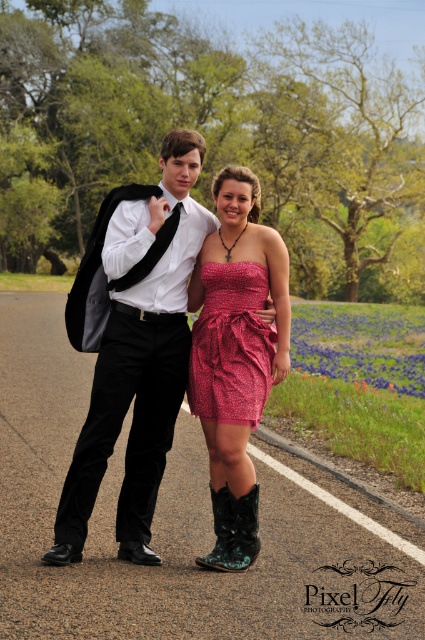
Is point (232, 515) positioned behind point (149, 262)?

That is False.

Does turquoise leather boot at lower center appear under black satin tie at center?

Indeed, turquoise leather boot at lower center is positioned under black satin tie at center.

Is point (215, 561) behind point (175, 211)?

No.

Where is `turquoise leather boot at lower center`? The width and height of the screenshot is (425, 640). turquoise leather boot at lower center is located at coordinates (235, 529).

Who is lower down, green suede boot at lower center or black satin tie at center?

green suede boot at lower center is below.

Which of these two, green suede boot at lower center or black satin tie at center, stands taller?

black satin tie at center is taller.

Identify the location of green suede boot at lower center. This screenshot has height=640, width=425. (221, 529).

Consider the image. Can you confirm if turquoise leather boot at lower center is positioned above green suede boot at lower center?

Indeed, turquoise leather boot at lower center is positioned over green suede boot at lower center.

Can you confirm if turquoise leather boot at lower center is wider than green suede boot at lower center?

Yes, turquoise leather boot at lower center is wider than green suede boot at lower center.

Identify the location of turquoise leather boot at lower center. (235, 529).